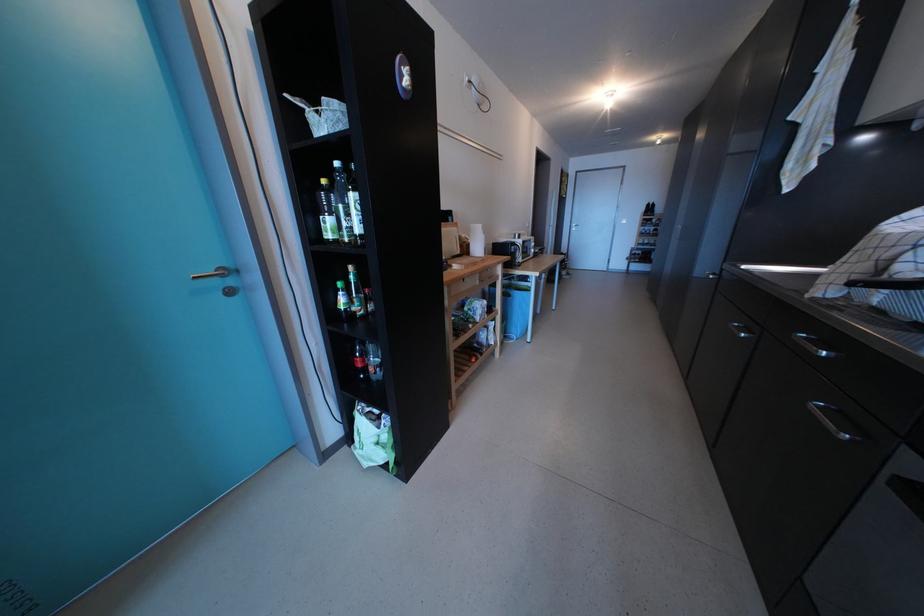
Locate an element on the screen. white wire basket is located at coordinates (322, 115).